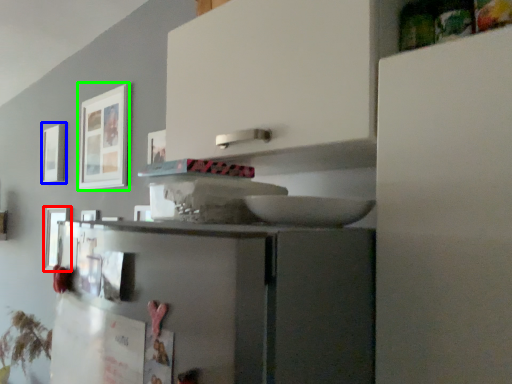
Question: Based on their relative distances, which object is farther from picture frame (highlighted by a red box)? Choose from picture frame (highlighted by a blue box) and picture frame (highlighted by a green box).

Choices:
 (A) picture frame
 (B) picture frame

Answer: (B)